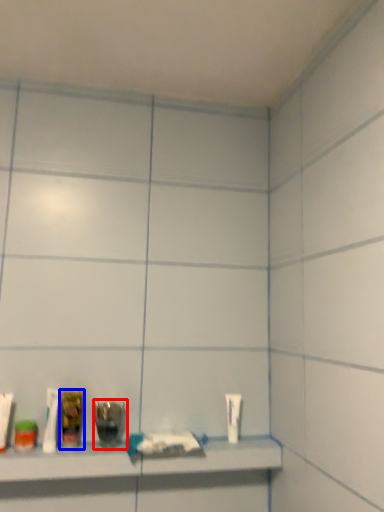
Question: Which of the following is the closest to the observer, mouthwash (highlighted by a red box) or mouthwash (highlighted by a blue box)?

Choices:
 (A) mouthwash
 (B) mouthwash

Answer: (B)